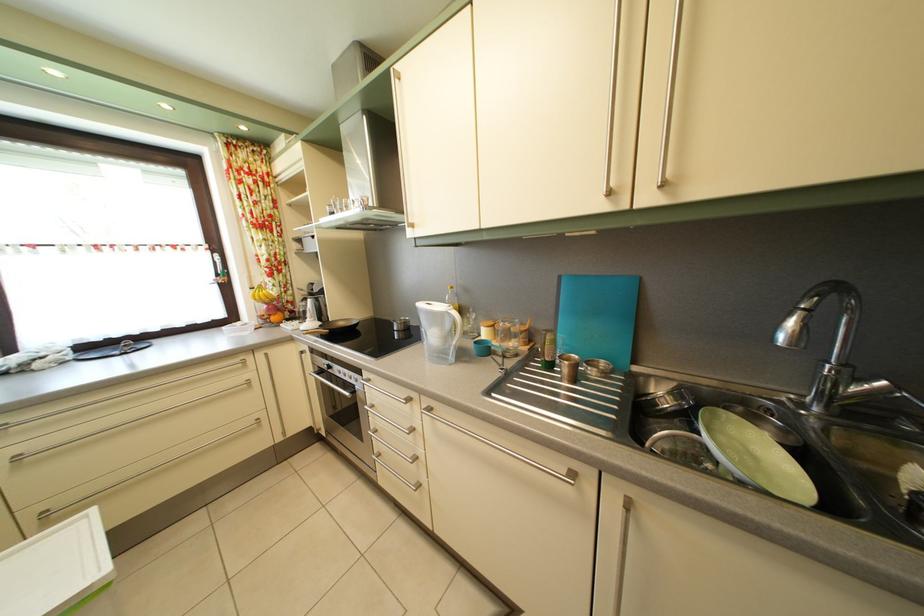
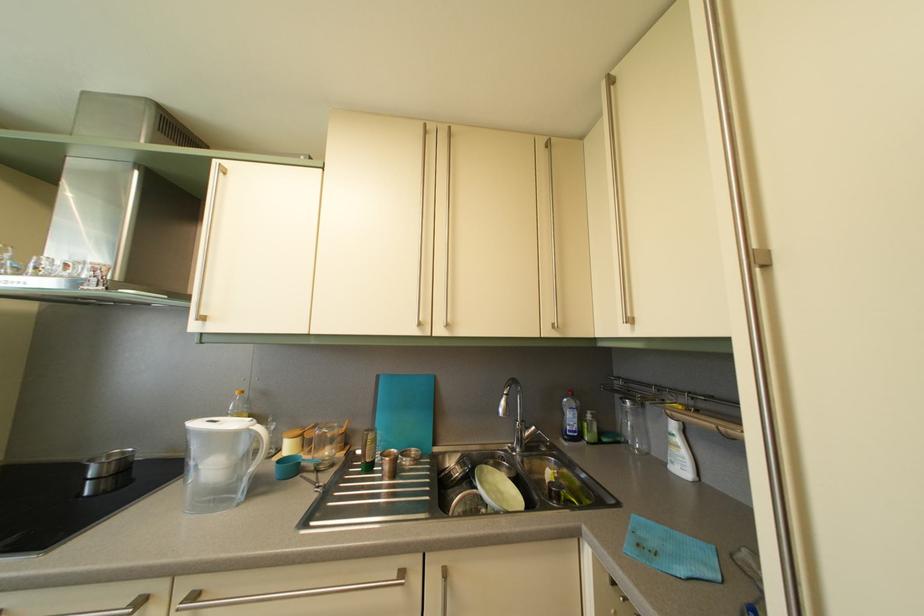
Where in the second image is the point corresponding to (852,373) from the first image?

(530, 429)